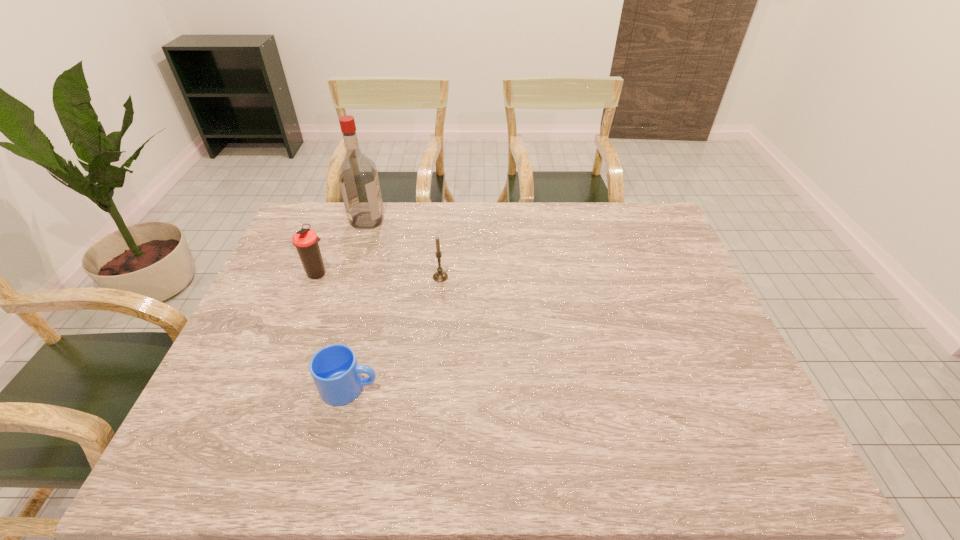
The image size is (960, 540). In order to click on blank region between the candle and the tallest object in this screenshot , I will do `click(404, 248)`.

Identify the location of free space that is in between the nearest object and the thermos bottle. The height and width of the screenshot is (540, 960). (334, 330).

Identify the location of free area in between the rightmost object and the mug. Image resolution: width=960 pixels, height=540 pixels. (396, 333).

Locate an element on the screen. unoccupied area between the shortest object and the liquor is located at coordinates (359, 304).

Where is `vacant area between the shortest object and the liquor`? The image size is (960, 540). vacant area between the shortest object and the liquor is located at coordinates (359, 304).

Identify the location of free area in between the farthest object and the rightmost object. This screenshot has width=960, height=540. (404, 248).

Where is `free area in between the nearest object and the rightmost object`? This screenshot has width=960, height=540. free area in between the nearest object and the rightmost object is located at coordinates (396, 333).

Find the location of a particular element. The height and width of the screenshot is (540, 960). vacant area that lies between the thermos bottle and the nearest object is located at coordinates (334, 330).

Where is `object that is the closest to the candle`? Image resolution: width=960 pixels, height=540 pixels. object that is the closest to the candle is located at coordinates (358, 178).

I want to click on object that is the second nearest to the nearest object, so click(x=440, y=276).